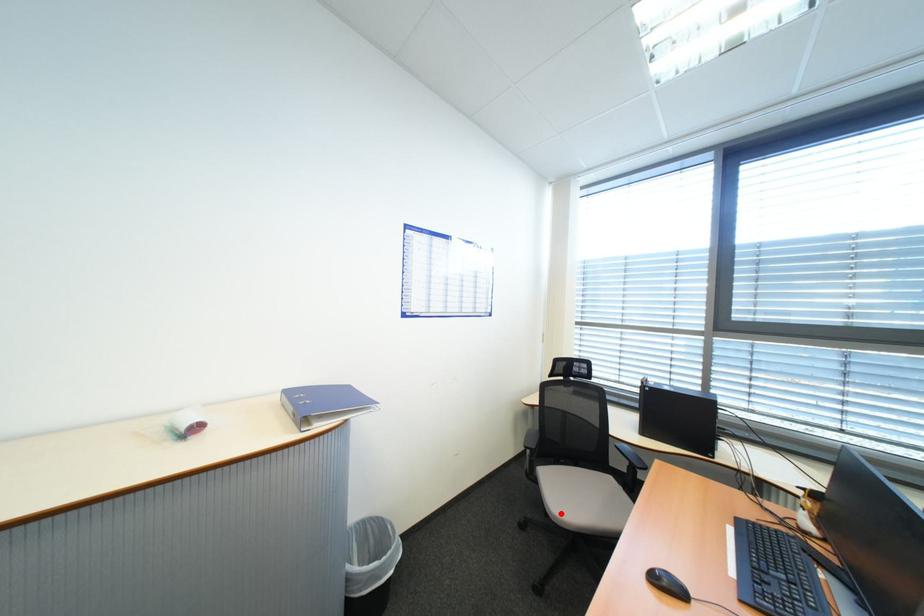
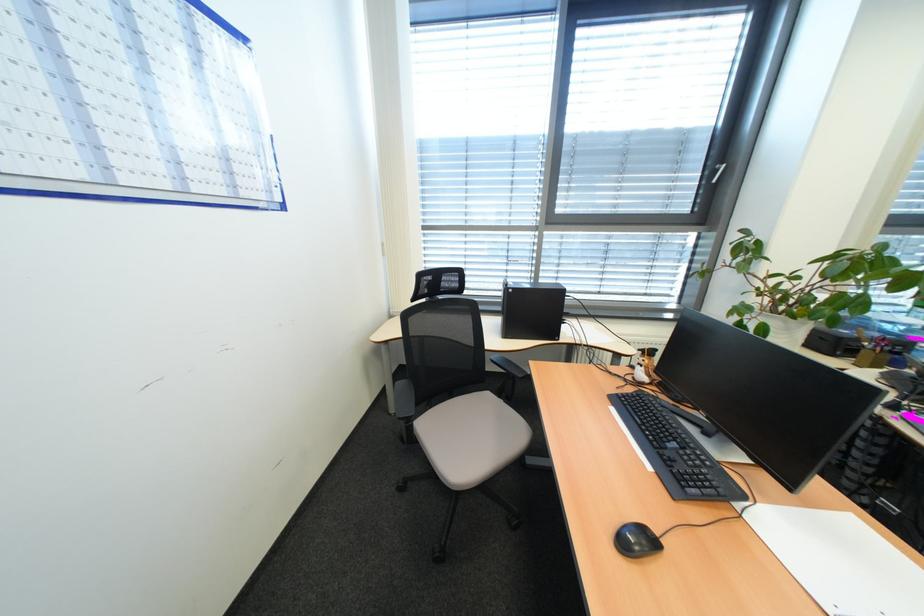
Where in the second image is the point corresponding to the highlighted location from the first image?

(459, 485)